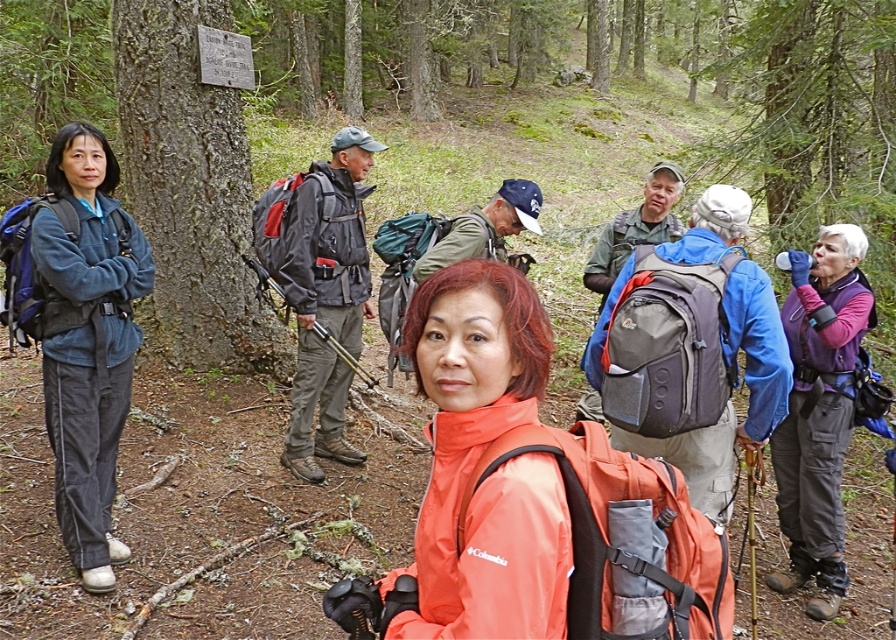
You are standing at the point marked as point [197,317] in the forest scene. You want to take a photo of the woman in the orange Columbia jacket who is facing you. Is there enough space between you and the woman to avoid blocking the shot?

The distance between you and the woman in the orange Columbia jacket is 6.16 meters, which should provide sufficient space to avoid blocking the shot as you can position yourself appropriately to capture her without obstruction.

From the picture: You are a hiker trying to locate two hikers in the group. The first is wearing a purple fleece vest at right, and the second is wearing a matte black jacket at center. Which of these two hikers is shorter?

The purple fleece vest at right has a lesser height compared to matte black jacket at center, so the hiker in the purple fleece vest at right is shorter.

In the scene shown: You are a hiker trying to locate the purple fleece vest at right. Based on the scene, where would you look relative to the smooth bark tree at left?

The smooth bark tree at left is above the purple fleece vest at right, so the purple fleece vest at right is located below the smooth bark tree at left.